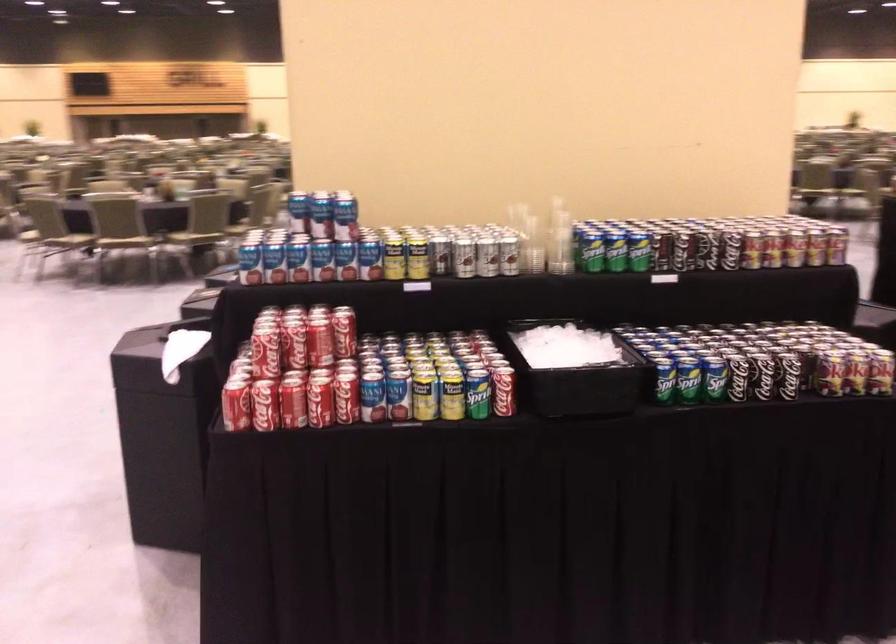
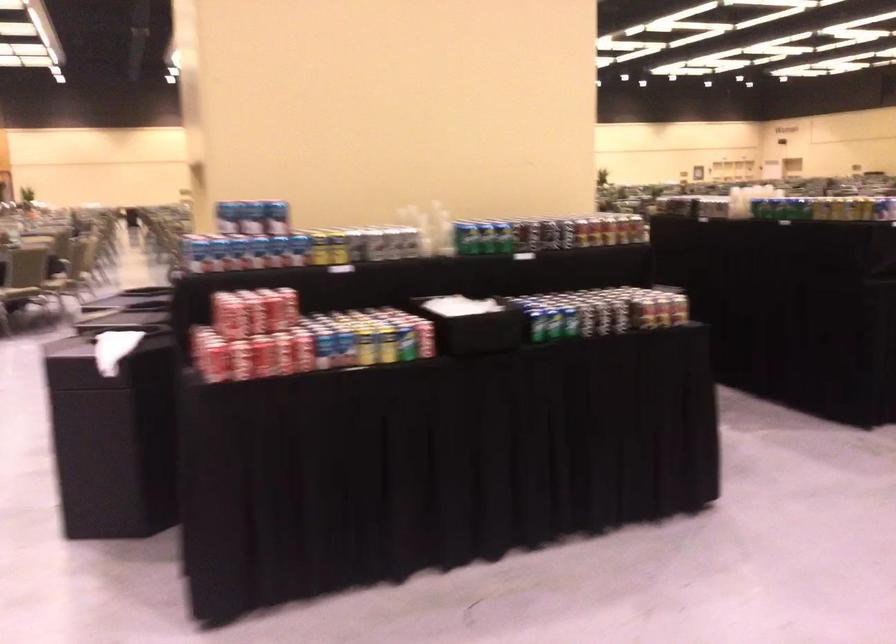
Find the pixel in the second image that matches point 590,248 in the first image.

(466, 238)